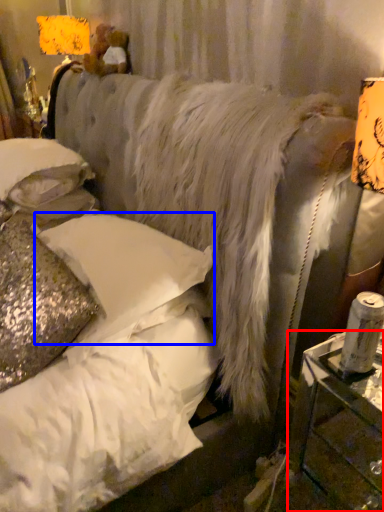
Question: Which object appears farthest to the camera in this image, table (highlighted by a red box) or pillow (highlighted by a blue box)?

Choices:
 (A) table
 (B) pillow

Answer: (B)